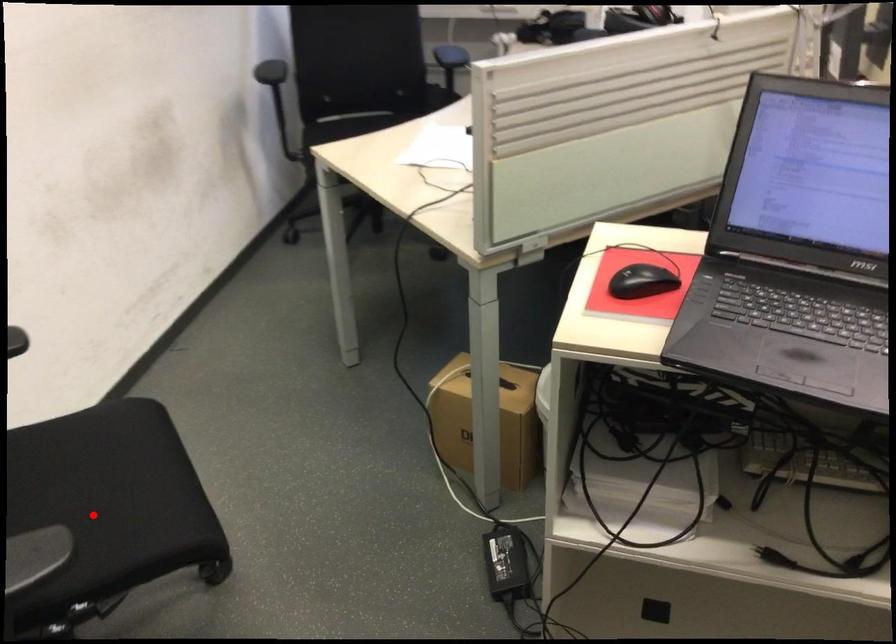
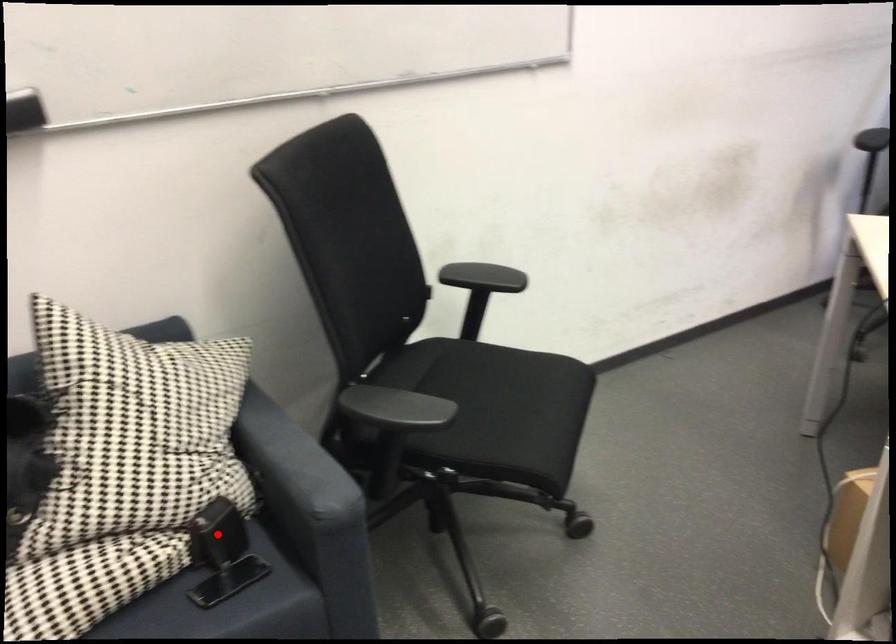
I am providing you with two images of the same scene from different viewpoints. A red point is marked on the first image and another point is marked on the second image. Do the highlighted points in image1 and image2 indicate the same real-world spot?

No